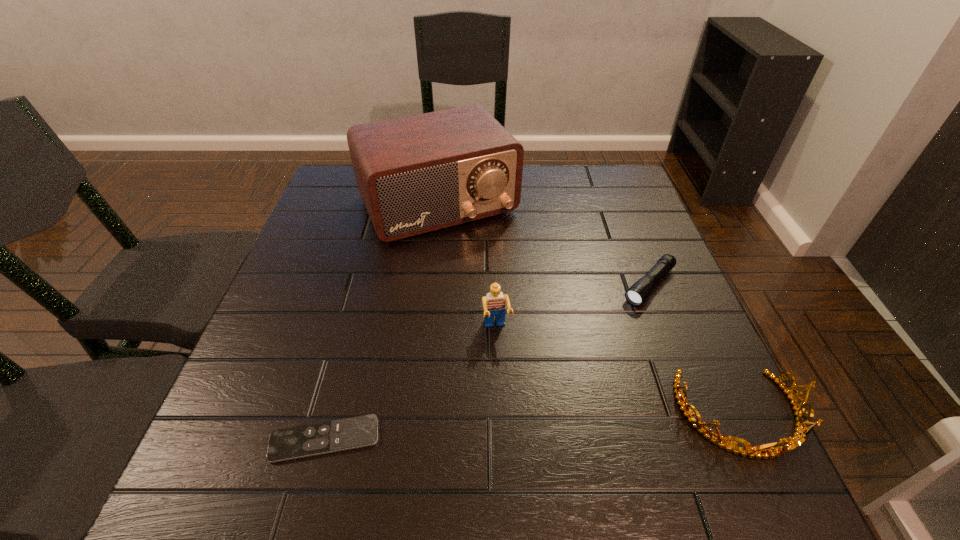
This screenshot has width=960, height=540. I want to click on free region located at the lens end of the fourth nearest object, so click(x=553, y=389).

At what (x,y) coordinates should I click in order to perform the action: click on vacant space located at the lens end of the fourth nearest object. Please return your answer as a coordinate pair (x, y). The width and height of the screenshot is (960, 540). Looking at the image, I should click on (608, 331).

Find the location of a particular element. This screenshot has width=960, height=540. free region located 0.200m on the front panel of the tallest object is located at coordinates (501, 297).

The image size is (960, 540). In order to click on vacant space located 0.130m on the front panel of the tallest object in this screenshot , I will do `click(489, 277)`.

Where is `free space located 0.340m on the front panel of the tallest object`? free space located 0.340m on the front panel of the tallest object is located at coordinates (530, 343).

This screenshot has height=540, width=960. Identify the location of object that is at the far edge. (416, 174).

The width and height of the screenshot is (960, 540). In order to click on remote control at the near edge in this screenshot , I will do click(x=285, y=444).

You are a GUI agent. You are given a task and a screenshot of the screen. Output one action in this format:
    pyautogui.click(x=<x>, y=<y>)
    Task: Click on the tiara that is at the near edge
    
    Given the screenshot: What is the action you would take?
    pyautogui.click(x=799, y=437)

You are a GUI agent. You are given a task and a screenshot of the screen. Output one action in this format:
    pyautogui.click(x=<x>, y=<y>)
    Task: Click on the remote control at the left edge
    This screenshot has width=960, height=540.
    Given the screenshot: What is the action you would take?
    pyautogui.click(x=285, y=444)

Identify the location of radio receiver at the left edge. (416, 174).